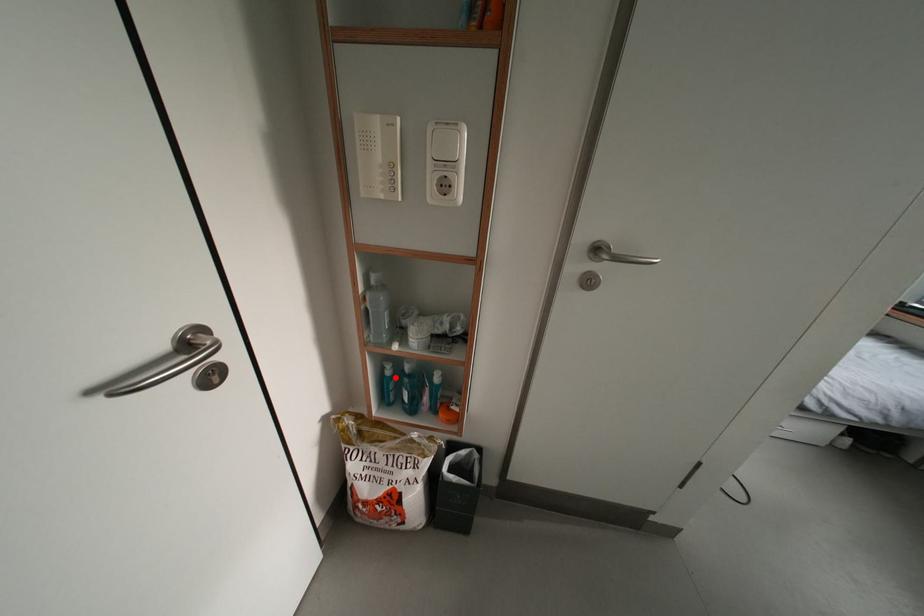
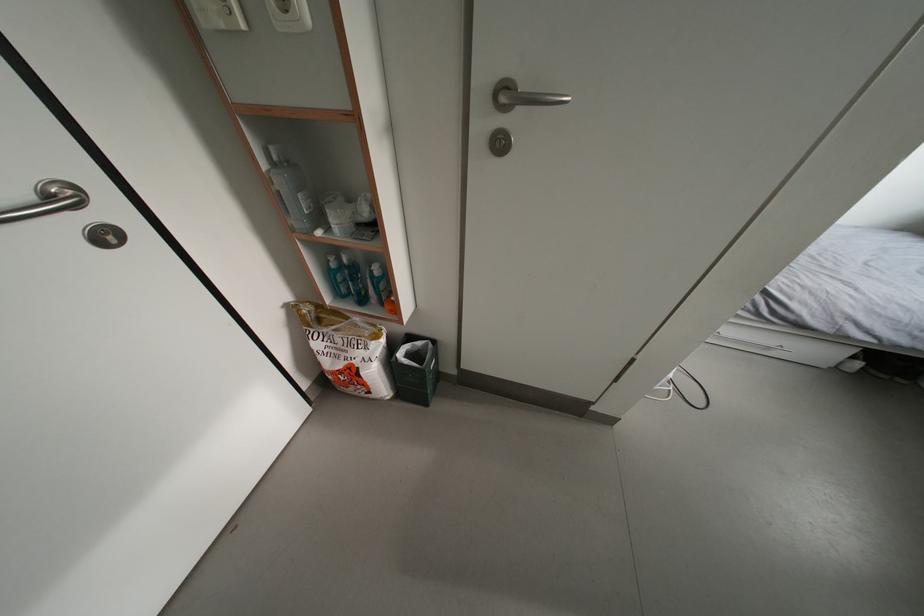
Locate, in the second image, the point that corresponds to the highlighted location in the first image.

(339, 270)